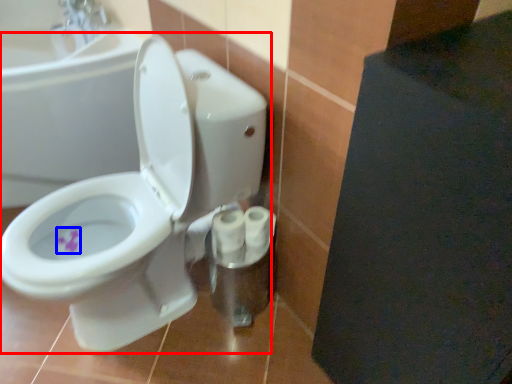
Question: Which object is closer to the camera taking this photo, toilet (highlighted by a red box) or flower (highlighted by a blue box)?

Choices:
 (A) toilet
 (B) flower

Answer: (A)